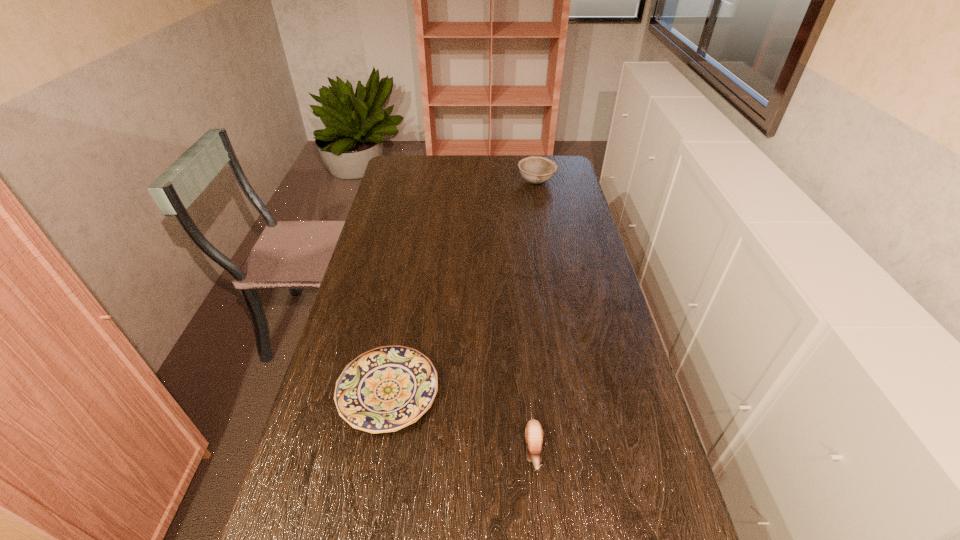
You are a GUI agent. You are given a task and a screenshot of the screen. Output one action in this format:
    pyautogui.click(x=<x>, y=<y>)
    Task: Click on the unoccupied position between the leftmost object and the escargot
    
    Given the screenshot: What is the action you would take?
    pyautogui.click(x=461, y=421)

Locate an element on the screen. This screenshot has width=960, height=540. free space between the shortest object and the farthest object is located at coordinates (463, 287).

Where is `free space between the second shortest object and the tallest object`? The width and height of the screenshot is (960, 540). free space between the second shortest object and the tallest object is located at coordinates (535, 316).

Find the location of a particular element. This screenshot has width=960, height=540. empty space that is in between the escargot and the leftmost object is located at coordinates (461, 421).

I want to click on free spot between the second shortest object and the plate, so click(461, 421).

You are a GUI agent. You are given a task and a screenshot of the screen. Output one action in this format:
    pyautogui.click(x=<x>, y=<y>)
    Task: Click on the vacant space that is in between the rightmost object and the escargot
    The height and width of the screenshot is (540, 960).
    Given the screenshot: What is the action you would take?
    pyautogui.click(x=535, y=316)

Identify the location of free spot between the second object from left to right and the bowl. The width and height of the screenshot is (960, 540). (535, 316).

Where is `object that stands as the closest to the shortest object`? The image size is (960, 540). object that stands as the closest to the shortest object is located at coordinates (533, 432).

Identify which object is the closest to the shortest object. Please provide its 2D coordinates. Your answer should be formatted as a tuple, i.e. [(x, y)], where the tuple contains the x and y coordinates of a point satisfying the conditions above.

[(533, 432)]

At what (x,y) coordinates should I click in order to perform the action: click on vacant space that satisfies the following two spatial constraints: 1. on the back side of the rightmost object; 2. on the left side of the leftmost object. Please return your answer as a coordinate pair (x, y). This screenshot has width=960, height=540. Looking at the image, I should click on (426, 182).